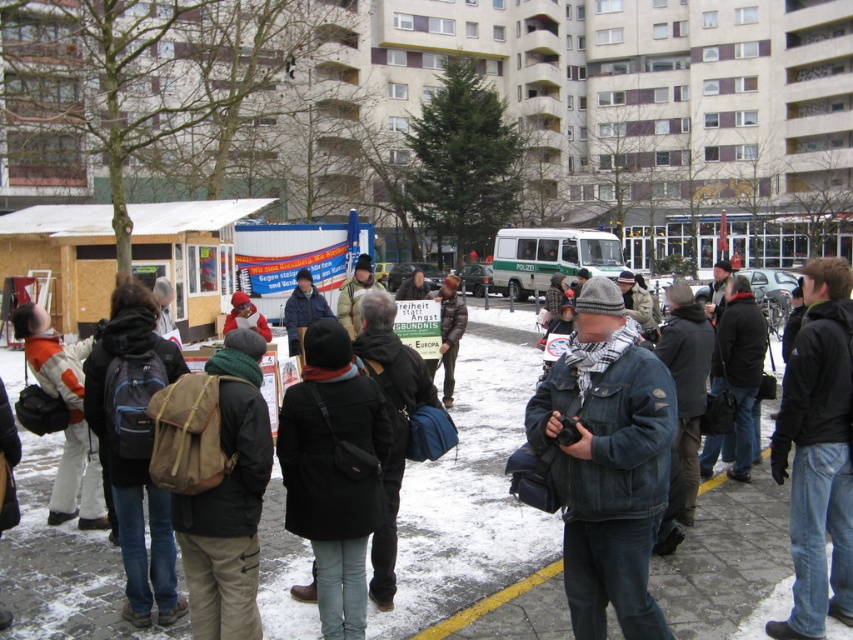
Between denim jacket at center and dark blue jeans at center, which one appears on the left side from the viewer's perspective?

From the viewer's perspective, denim jacket at center appears more on the left side.

This screenshot has width=853, height=640. What do you see at coordinates (607, 464) in the screenshot? I see `denim jacket at center` at bounding box center [607, 464].

Find the location of `denim jacket at center`. denim jacket at center is located at coordinates (607, 464).